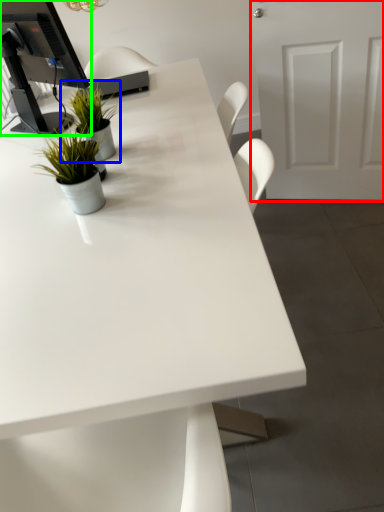
Question: Considering the real-world distances, which object is farthest from door (highlighted by a red box)? houseplant (highlighted by a blue box) or desktop computer (highlighted by a green box)?

Choices:
 (A) houseplant
 (B) desktop computer

Answer: (B)